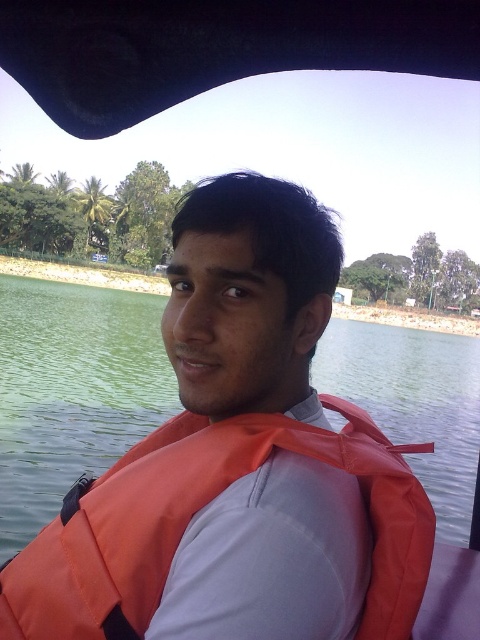
You are a photographer trying to capture the orange fabric life jacket at center and the green water at center in a single shot. Which object will occupy more of the frame?

The green water at center is bigger than orange fabric life jacket at center, so it will occupy more of the frame.

You are a photographer positioned to the left of the boat. You want to capture a shot where the green water at center is on the right side of the orange fabric life jacket at center. Is the current arrangement of the objects in the scene suitable for your desired composition?

Yes, the current arrangement is suitable because the green water at center is already positioned to the right of the orange fabric life jacket at center, matching your desired composition.